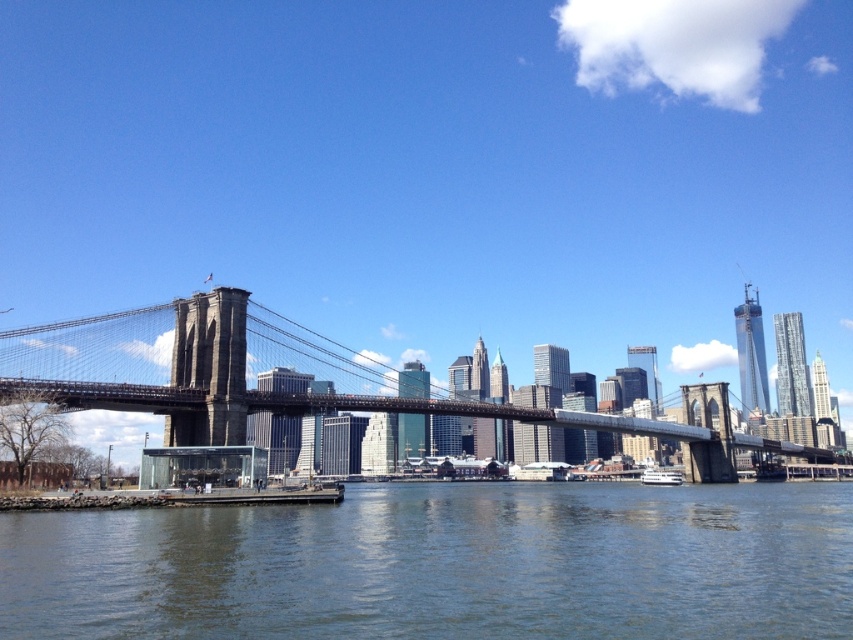
Does dark gray steel suspension bridge at center have a lesser width compared to white glossy boat at lower center?

Incorrect, dark gray steel suspension bridge at center's width is not less than white glossy boat at lower center's.

Measure the distance between point (115, 324) and camera.

279.27 feet

Identify the location of dark gray steel suspension bridge at center. The height and width of the screenshot is (640, 853). (201, 368).

Between greenish-blue water at lower center and white glossy boat at lower center, which one has less height?

Standing shorter between the two is white glossy boat at lower center.

Is point (838, 509) farther from viewer compared to point (654, 472)?

No, (838, 509) is in front of (654, 472).

Between point (80, 609) and point (659, 474), which one is positioned behind?

Positioned behind is point (659, 474).

You are a GUI agent. You are given a task and a screenshot of the screen. Output one action in this format:
    pyautogui.click(x=<x>, y=<y>)
    Task: Click on the greenish-blue water at lower center
    The width and height of the screenshot is (853, 640).
    Given the screenshot: What is the action you would take?
    pyautogui.click(x=444, y=564)

Does greenish-blue water at lower center lie in front of dark gray steel suspension bridge at center?

Yes, greenish-blue water at lower center is in front of dark gray steel suspension bridge at center.

Describe the element at coordinates (444, 564) in the screenshot. The image size is (853, 640). I see `greenish-blue water at lower center` at that location.

Which is behind, point (709, 497) or point (254, 362)?

Point (254, 362)

Image resolution: width=853 pixels, height=640 pixels. I want to click on greenish-blue water at lower center, so (x=444, y=564).